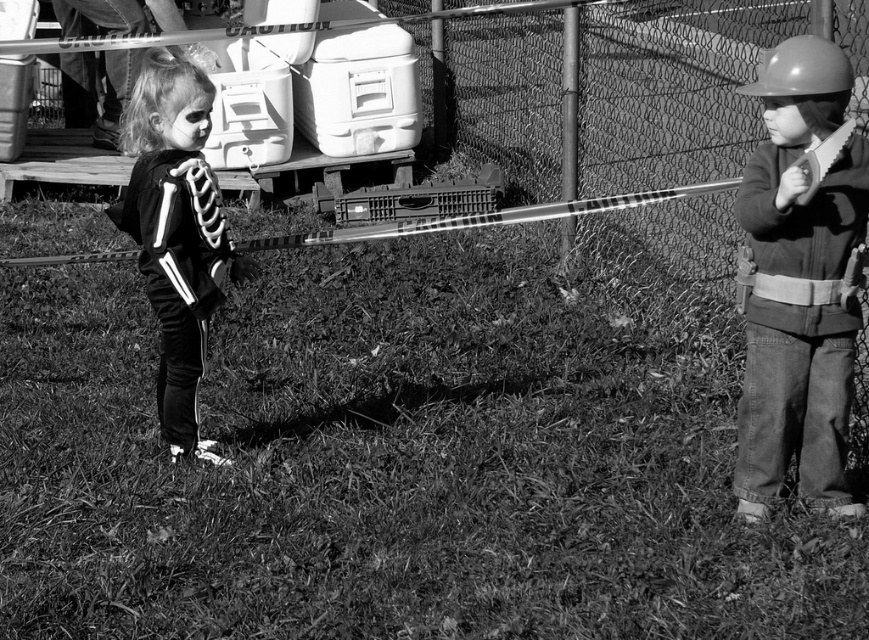
Question: Does hard hat at right have a lesser width compared to black matte skeleton costume at left?

Choices:
 (A) yes
 (B) no

Answer: (A)

Question: Which is farther from the black matte skeleton costume at left?

Choices:
 (A) matte gray helmet at right
 (B) matte black costume at left
 (C) hard hat at right

Answer: (B)

Question: Which point is closer to the camera?

Choices:
 (A) hard hat at right
 (B) matte black costume at left

Answer: (A)

Question: Is hard hat at right wider than matte black costume at left?

Choices:
 (A) yes
 (B) no

Answer: (B)

Question: Can you confirm if black matte skeleton costume at left is wider than matte gray helmet at right?

Choices:
 (A) yes
 (B) no

Answer: (A)

Question: Which point appears farthest from the camera in this image?

Choices:
 (A) (775, 420)
 (B) (164, 58)
 (C) (64, 54)
 (D) (811, 109)

Answer: (C)